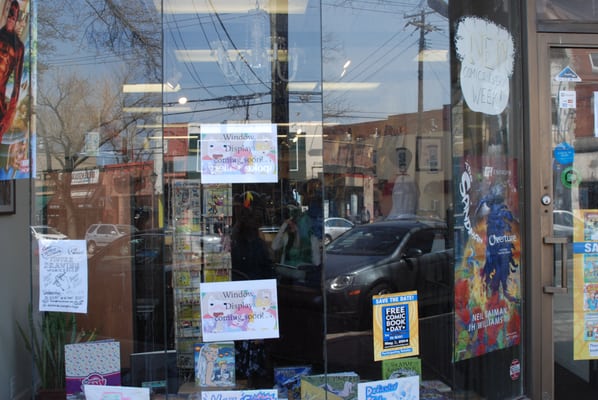
The height and width of the screenshot is (400, 598). In order to click on door handle in this screenshot , I will do `click(563, 241)`.